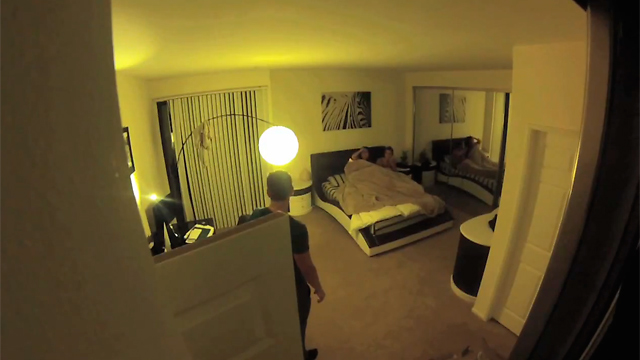
Find the location of a particular element. The width and height of the screenshot is (640, 360). light is located at coordinates coord(274,149), coord(150,194), coord(131,188).